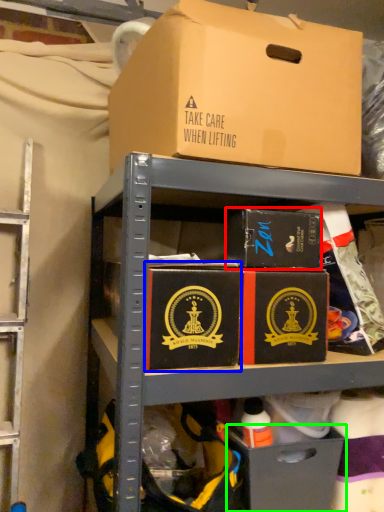
Question: Which object is positioned closest to box (highlighted by a red box)? Select from box (highlighted by a blue box) and drawer (highlighted by a green box).

Choices:
 (A) box
 (B) drawer

Answer: (A)